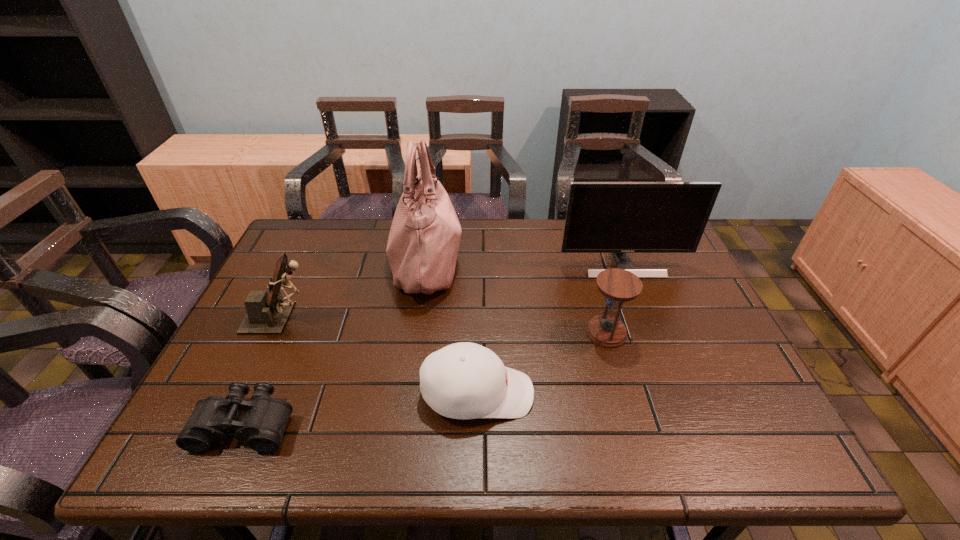
Identify the location of handbag. Image resolution: width=960 pixels, height=540 pixels. (422, 248).

Find the location of a particular element. The image size is (960, 540). the second tallest object is located at coordinates (601, 217).

This screenshot has height=540, width=960. Identify the location of the third tallest object. (267, 313).

Where is `hourglass`? The height and width of the screenshot is (540, 960). hourglass is located at coordinates click(x=618, y=286).

At what (x,y) coordinates should I click in order to perform the action: click on baseball cap. Please return your answer as a coordinate pair (x, y). This screenshot has height=540, width=960. Looking at the image, I should click on (465, 380).

Locate an element on the screen. The image size is (960, 540). binoculars is located at coordinates (262, 426).

The height and width of the screenshot is (540, 960). What are the coordinates of `vacant space situated at the front of the tallest object with handles` in the screenshot? It's located at coord(537,261).

Locate an element on the screen. vacant space situated on the screen side of the fifth shortest object is located at coordinates (669, 385).

At what (x,y) coordinates should I click in order to perform the action: click on vacant region located 0.060m on the front-facing side of the figurine. Please return your answer as a coordinate pair (x, y). The width and height of the screenshot is (960, 540). Looking at the image, I should click on (338, 318).

The image size is (960, 540). Find the location of `vacant space located 0.390m on the left of the fourth tallest object`. vacant space located 0.390m on the left of the fourth tallest object is located at coordinates (436, 333).